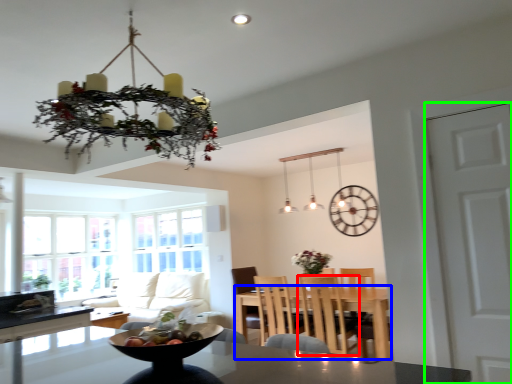
Question: Estimate the real-world distances between objects in this image. Which object is farther from chair (highlighted by a red box), table (highlighted by a blue box) or door (highlighted by a green box)?

Choices:
 (A) table
 (B) door

Answer: (B)